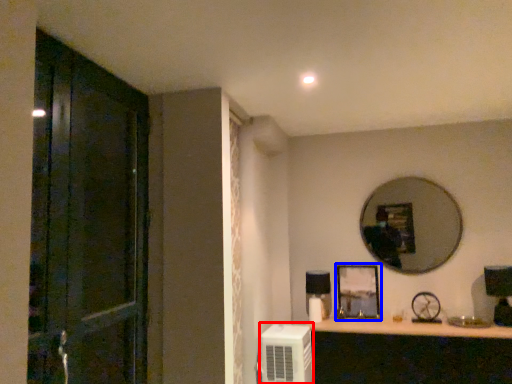
Question: Which object appears farthest to the camera in this image, air conditioner (highlighted by a red box) or picture frame (highlighted by a blue box)?

Choices:
 (A) air conditioner
 (B) picture frame

Answer: (B)